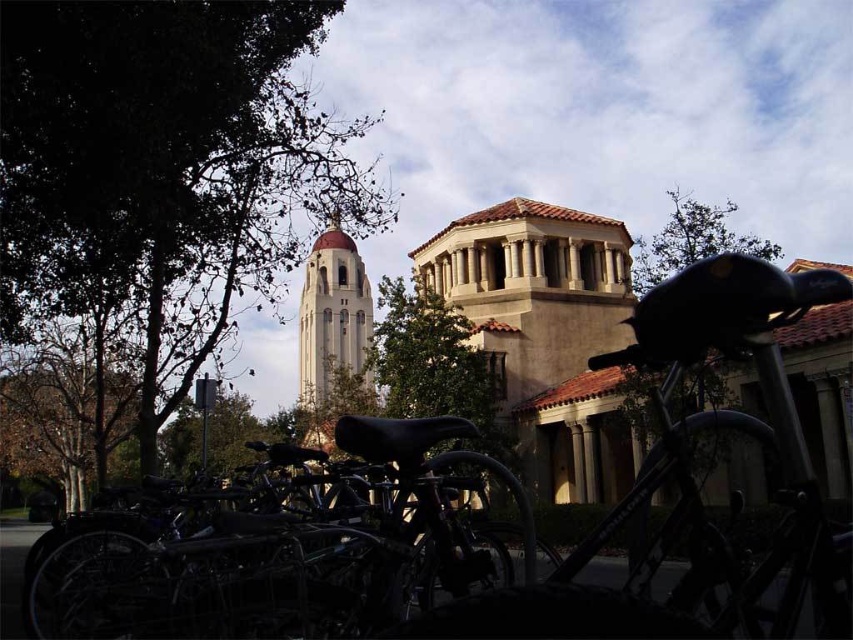
You are standing in front of a historic building with a tower. You want to take a photo of the smooth beige tower at center from a distance that allows the entire tower to fit in the frame. Given that your camera has a maximum zoom capacity of 100 meters, can you capture the tower without moving closer?

The smooth beige tower at center is 66.66 meters away from the viewer. Since your camera can zoom up to 100 meters, you can capture the tower without moving closer because the distance is within the camera range.

You are standing in front of the historic building and want to take a photo that includes both the tower and the bicycle rack. You notice two points marked as point 1 at coordinates (373, 456) and point 2 at (462, 337). Which point should you stand closer to ensure both the tower and the bicycle rack are in focus?

You should stand closer to point 1 at coordinates (373, 456) because it is closer to the viewer, allowing both the tower and the bicycle rack to be in focus simultaneously.

You are a visitor at the historic building and want to park your bicycle. You see the shiny black bicycle at lower center and the green leafy tree at center. Which object is smaller and should you avoid parking under it to prevent blocking the tree?

The shiny black bicycle at lower center is smaller than the green leafy tree at center. You should avoid parking under the green leafy tree at center to prevent blocking it.